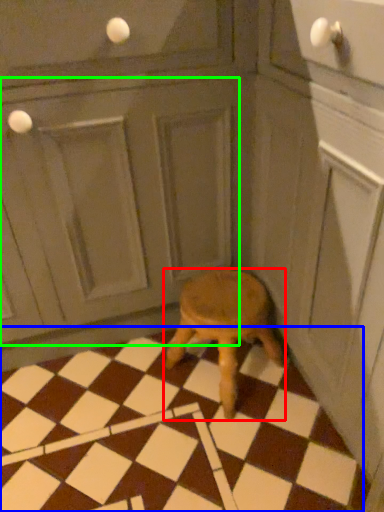
Question: Which object is the closest to the stool (highlighted by a red box)? Choose among these: tile (highlighted by a blue box) or screen door (highlighted by a green box).

Choices:
 (A) tile
 (B) screen door

Answer: (A)